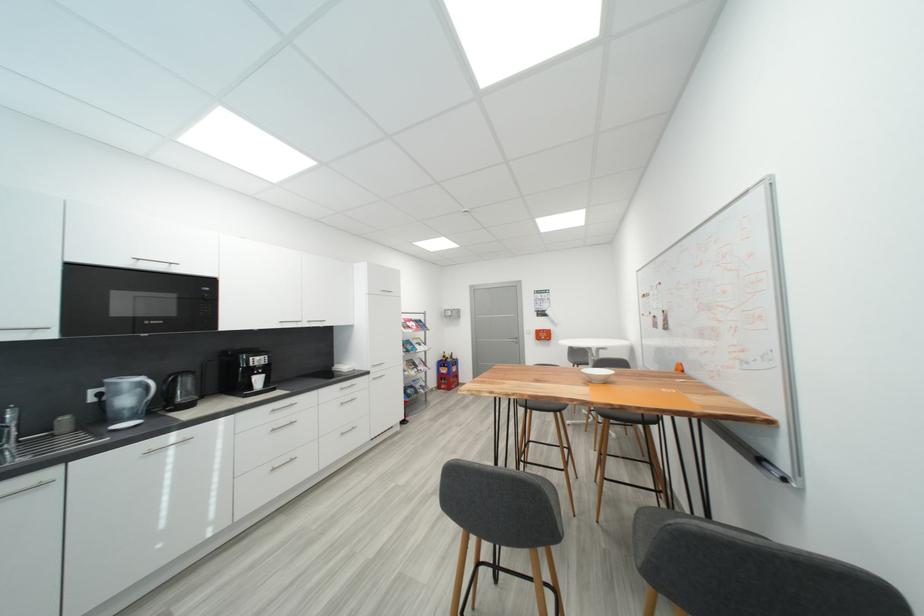
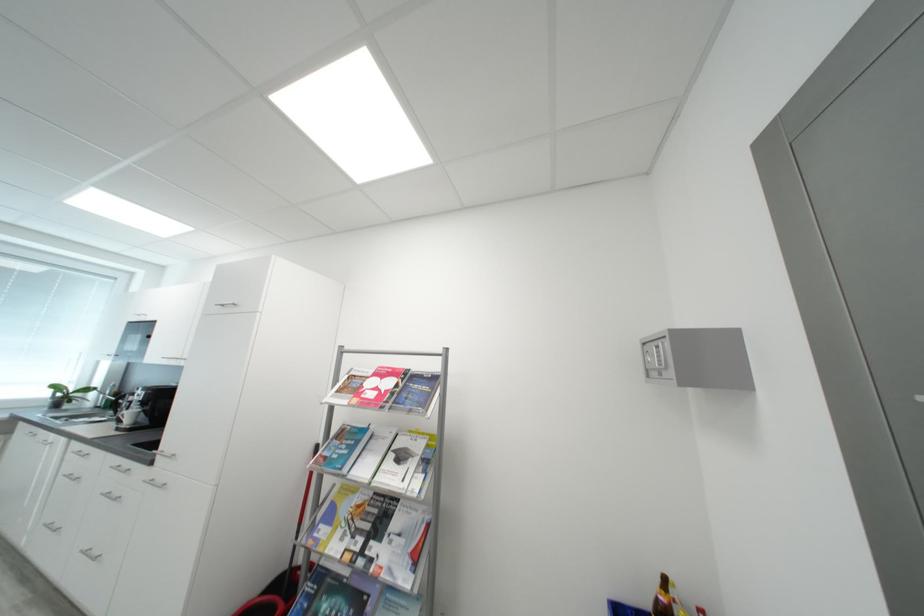
The point at (426, 370) is marked in the first image. Where is the corresponding point in the second image?

(380, 549)